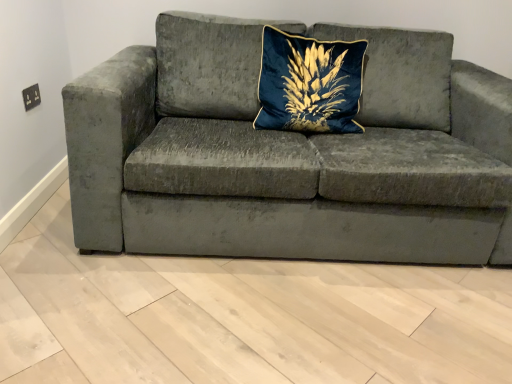
Question: From a real-world perspective, is velvet blue pillow at center positioned above or below velvet gray couch at center?

Choices:
 (A) above
 (B) below

Answer: (A)

Question: Would you say velvet blue pillow at center is inside or outside velvet gray couch at center?

Choices:
 (A) inside
 (B) outside

Answer: (A)

Question: In terms of height, does velvet blue pillow at center look taller or shorter compared to velvet gray couch at center?

Choices:
 (A) short
 (B) tall

Answer: (A)

Question: From a real-world perspective, is velvet gray couch at center above or below velvet blue pillow at center?

Choices:
 (A) above
 (B) below

Answer: (B)

Question: From the image's perspective, relative to velvet blue pillow at center, is velvet gray couch at center above or below?

Choices:
 (A) below
 (B) above

Answer: (A)

Question: Is velvet gray couch at center spatially inside velvet blue pillow at center, or outside of it?

Choices:
 (A) outside
 (B) inside

Answer: (A)

Question: Is velvet gray couch at center taller or shorter than velvet blue pillow at center?

Choices:
 (A) short
 (B) tall

Answer: (B)